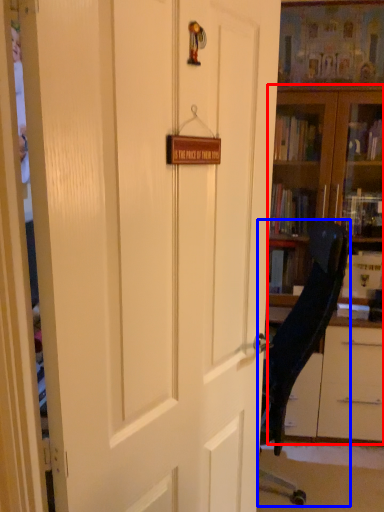
Question: Among these objects, which one is nearest to the camera, bookcase (highlighted by a red box) or chair (highlighted by a blue box)?

Choices:
 (A) bookcase
 (B) chair

Answer: (B)